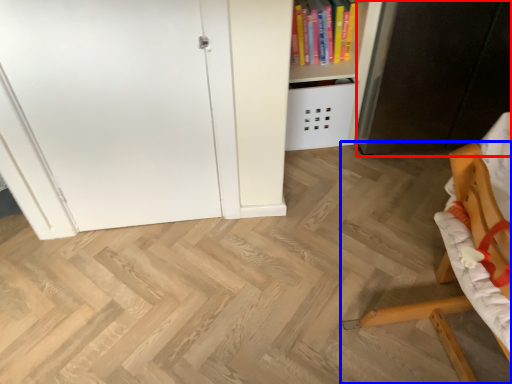
Question: Which object appears farthest to the camera in this image, cabinetry (highlighted by a red box) or furniture (highlighted by a blue box)?

Choices:
 (A) cabinetry
 (B) furniture

Answer: (A)